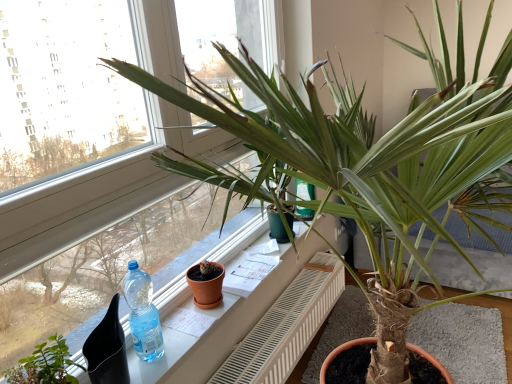
Image resolution: width=512 pixels, height=384 pixels. In order to click on free location above white glossy window sill at center (from a real-world perspective) in this screenshot , I will do pyautogui.click(x=225, y=286).